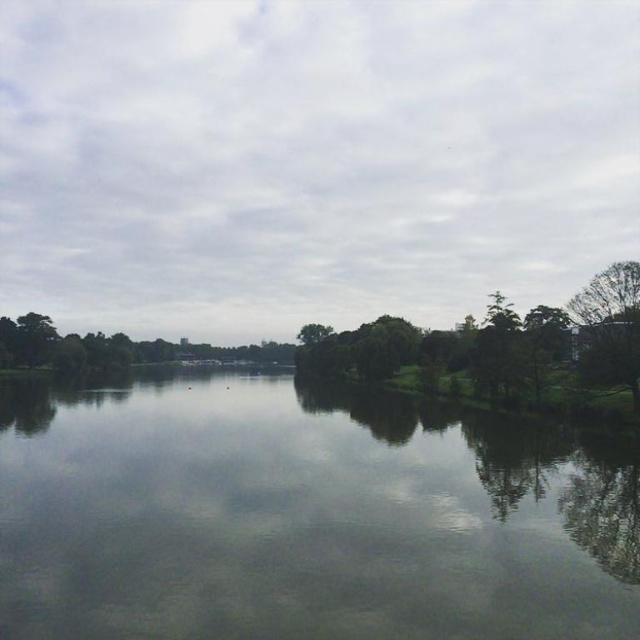
Based on the photo, does clear water at center have a larger size compared to green leafy trees at center?

Actually, clear water at center might be smaller than green leafy trees at center.

Between clear water at center and green leafy trees at center, which one is positioned higher?

green leafy trees at center

This screenshot has height=640, width=640. Identify the location of clear water at center. (305, 515).

Does green leafy trees at center have a larger size compared to green leafy tree at right?

Indeed, green leafy trees at center has a larger size compared to green leafy tree at right.

How distant is green leafy trees at center from green leafy tree at right?

green leafy trees at center and green leafy tree at right are 17.19 meters apart from each other.

Find the location of `green leafy trees at center`. green leafy trees at center is located at coordinates (499, 349).

Identify the location of green leafy trees at center. The image size is (640, 640). (499, 349).

Between clear water at center and green leafy tree at right, which one appears on the right side from the viewer's perspective?

Positioned to the right is green leafy tree at right.

The width and height of the screenshot is (640, 640). In order to click on clear water at center in this screenshot , I will do (x=305, y=515).

Find the location of a particular element. The image size is (640, 640). clear water at center is located at coordinates (305, 515).